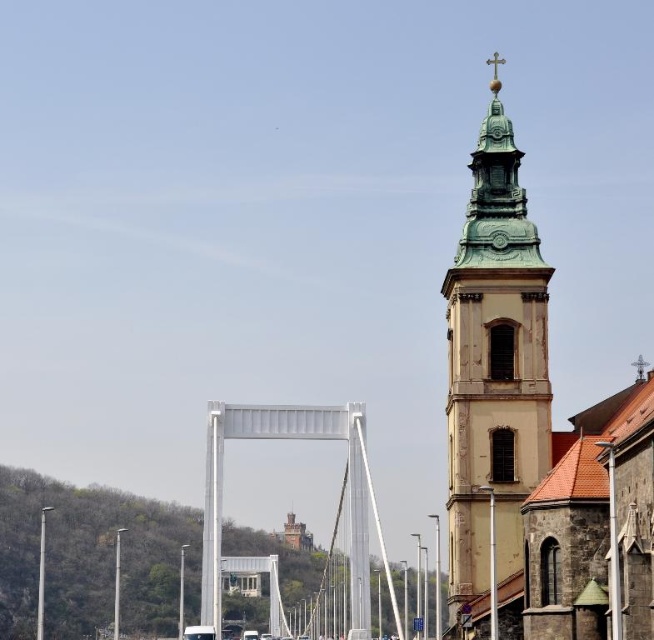
Question: Is green copper tower at right positioned before white metallic bridge at center?

Choices:
 (A) no
 (B) yes

Answer: (B)

Question: Is green copper tower at right to the right of white metallic bridge at center from the viewer's perspective?

Choices:
 (A) yes
 (B) no

Answer: (A)

Question: Among these objects, which one is farthest from the camera?

Choices:
 (A) green copper tower at right
 (B) white metallic bridge at center

Answer: (B)

Question: Does green copper tower at right lie in front of white metallic bridge at center?

Choices:
 (A) yes
 (B) no

Answer: (A)

Question: Which point is farther from the camera taking this photo?

Choices:
 (A) (492, 304)
 (B) (354, 637)

Answer: (B)

Question: Which point is farther to the camera?

Choices:
 (A) white metallic bridge at center
 (B) green copper tower at right

Answer: (A)